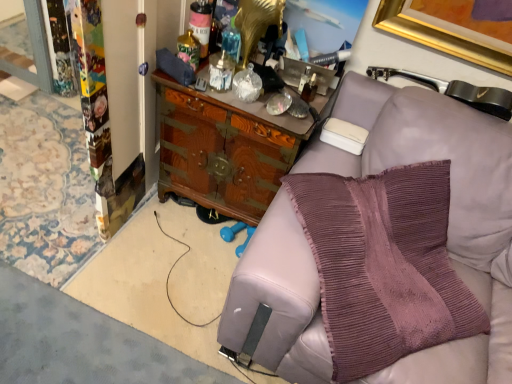
Question: From the image's perspective, is purple knitted pillow at right above or below wooden cabinet at center?

Choices:
 (A) below
 (B) above

Answer: (A)

Question: Choose the correct answer: Is purple knitted pillow at right inside wooden cabinet at center or outside it?

Choices:
 (A) inside
 (B) outside

Answer: (B)

Question: Considering the positions of purple knitted pillow at right and wooden cabinet at center in the image, is purple knitted pillow at right bigger or smaller than wooden cabinet at center?

Choices:
 (A) small
 (B) big

Answer: (B)

Question: From a real-world perspective, is wooden cabinet at center physically located above or below purple knitted pillow at right?

Choices:
 (A) above
 (B) below

Answer: (B)

Question: Is wooden cabinet at center bigger or smaller than purple knitted pillow at right?

Choices:
 (A) big
 (B) small

Answer: (B)

Question: Is wooden cabinet at center taller or shorter than purple knitted pillow at right?

Choices:
 (A) short
 (B) tall

Answer: (A)

Question: Looking at their shapes, would you say wooden cabinet at center is wider or thinner than purple knitted pillow at right?

Choices:
 (A) wide
 (B) thin

Answer: (A)